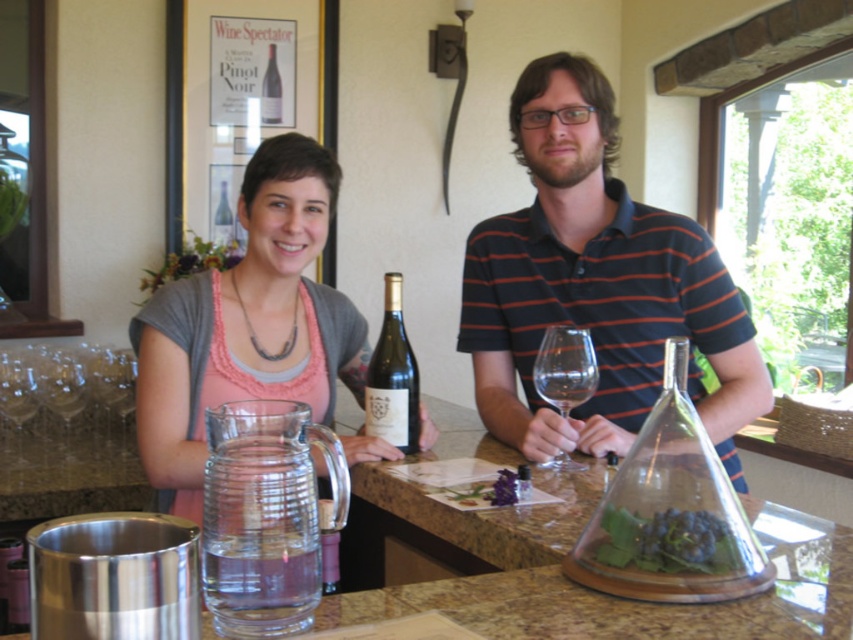
Does matte glass bottle at center have a larger size compared to transparent glass wine glass at center?

Yes.

Can you confirm if matte glass bottle at center is thinner than transparent glass wine glass at center?

No, matte glass bottle at center is not thinner than transparent glass wine glass at center.

Find the location of `matte glass bottle at center`. matte glass bottle at center is located at coordinates (393, 378).

At what (x,y) coordinates should I click in order to perform the action: click on matte glass bottle at center. Please return your answer as a coordinate pair (x, y). This screenshot has height=640, width=853. Looking at the image, I should click on (393, 378).

Between striped cotton polo shirt at center and transparent glass wine glass at center, which one has less height?

transparent glass wine glass at center

Which is behind, point (635, 314) or point (573, 337)?

Positioned behind is point (635, 314).

What do you see at coordinates (596, 284) in the screenshot? I see `striped cotton polo shirt at center` at bounding box center [596, 284].

The width and height of the screenshot is (853, 640). Identify the location of striped cotton polo shirt at center. (596, 284).

Is transparent glass wine glass at center in front of matte glass wine bottle at center?

That is True.

Between point (583, 358) and point (228, 186), which one is positioned in front?

Point (583, 358)

Identify the location of transparent glass wine glass at center. The image size is (853, 640). (566, 368).